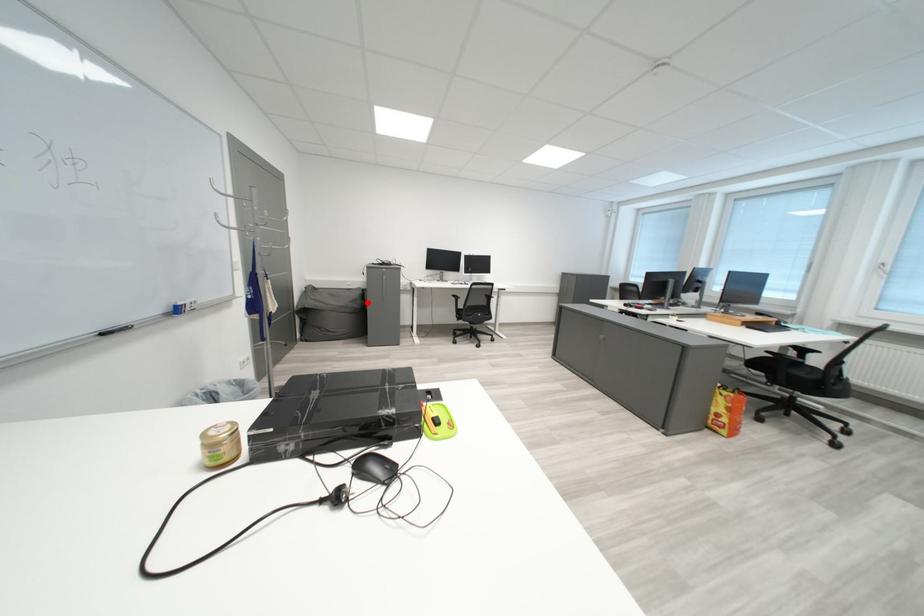
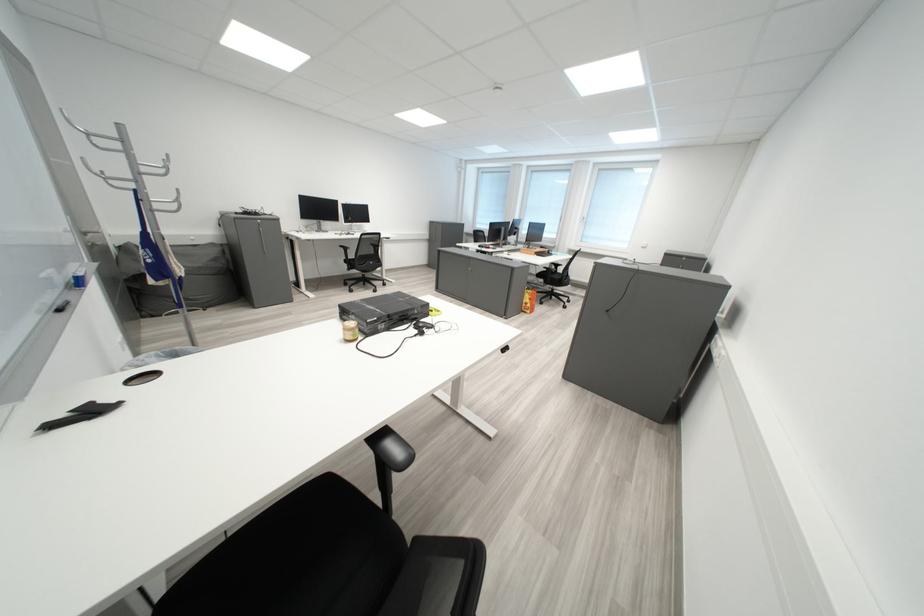
The point at the highlighted location is marked in the first image. Where is the corresponding point in the second image?

(228, 262)